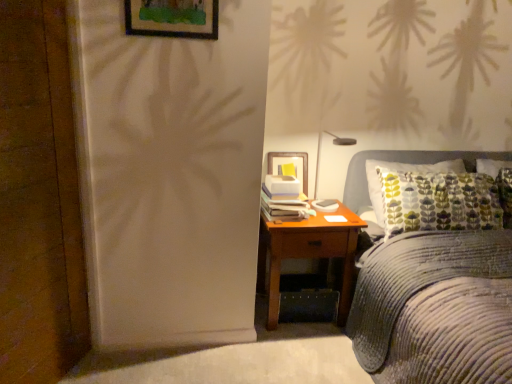
Question: Should I look upward or downward to see corduroy fabric bed at right?

Choices:
 (A) up
 (B) down

Answer: (B)

Question: Considering the relative sizes of brown wooden nightstand at right and wooden picture frame at upper center in the image provided, is brown wooden nightstand at right shorter than wooden picture frame at upper center?

Choices:
 (A) yes
 (B) no

Answer: (B)

Question: Can you confirm if brown wooden nightstand at right is positioned to the left of wooden picture frame at upper center?

Choices:
 (A) no
 (B) yes

Answer: (A)

Question: Can you confirm if brown wooden nightstand at right is taller than wooden picture frame at upper center?

Choices:
 (A) yes
 (B) no

Answer: (A)

Question: From a real-world perspective, does brown wooden nightstand at right stand above wooden picture frame at upper center?

Choices:
 (A) no
 (B) yes

Answer: (A)

Question: Would you consider brown wooden nightstand at right to be distant from wooden picture frame at upper center?

Choices:
 (A) yes
 (B) no

Answer: (A)

Question: Could you tell me if brown wooden nightstand at right is facing wooden picture frame at upper center?

Choices:
 (A) no
 (B) yes

Answer: (A)

Question: Is wooden picture frame at upper center not within matte black lamp at upper right?

Choices:
 (A) yes
 (B) no

Answer: (A)

Question: From the image's perspective, would you say wooden picture frame at upper center is positioned over matte black lamp at upper right?

Choices:
 (A) no
 (B) yes

Answer: (B)

Question: From a real-world perspective, is wooden picture frame at upper center on top of matte black lamp at upper right?

Choices:
 (A) no
 (B) yes

Answer: (B)

Question: Can you confirm if wooden picture frame at upper center is smaller than matte black lamp at upper right?

Choices:
 (A) yes
 (B) no

Answer: (A)

Question: From the image's perspective, would you say wooden picture frame at upper center is shown under matte black lamp at upper right?

Choices:
 (A) no
 (B) yes

Answer: (A)

Question: Is wooden picture frame at upper center beside matte black lamp at upper right?

Choices:
 (A) no
 (B) yes

Answer: (A)

Question: Is wooden picture frame at upper center facing towards corduroy fabric bed at right?

Choices:
 (A) no
 (B) yes

Answer: (A)